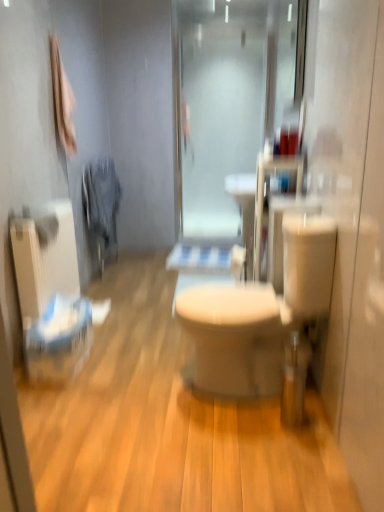
Question: Does beige matte toilet at center have a greater height compared to white glossy toilet at center?

Choices:
 (A) no
 (B) yes

Answer: (B)

Question: Can you confirm if beige matte toilet at center is thinner than white glossy toilet at center?

Choices:
 (A) yes
 (B) no

Answer: (A)

Question: From a real-world perspective, is beige matte toilet at center physically above white glossy toilet at center?

Choices:
 (A) yes
 (B) no

Answer: (A)

Question: Is beige matte toilet at center facing towards white glossy toilet at center?

Choices:
 (A) yes
 (B) no

Answer: (B)

Question: Is beige matte toilet at center next to white glossy toilet at center?

Choices:
 (A) no
 (B) yes

Answer: (A)

Question: Considering the relative positions of beige matte toilet at center and white glossy toilet at center in the image provided, is beige matte toilet at center to the right of white glossy toilet at center from the viewer's perspective?

Choices:
 (A) yes
 (B) no

Answer: (A)

Question: Does white matte toilet paper at center have a lesser width compared to frosted glass shower door at center?

Choices:
 (A) yes
 (B) no

Answer: (B)

Question: Is white matte toilet paper at center further to the viewer compared to frosted glass shower door at center?

Choices:
 (A) no
 (B) yes

Answer: (A)

Question: From the image's perspective, does white matte toilet paper at center appear higher than frosted glass shower door at center?

Choices:
 (A) no
 (B) yes

Answer: (A)

Question: Is white matte toilet paper at center positioned far away from frosted glass shower door at center?

Choices:
 (A) no
 (B) yes

Answer: (B)

Question: Does white matte toilet paper at center lie in front of frosted glass shower door at center?

Choices:
 (A) no
 (B) yes

Answer: (B)

Question: Can frosted glass shower door at center be found inside white matte toilet paper at center?

Choices:
 (A) yes
 (B) no

Answer: (B)

Question: Does frosted glass shower door at center appear on the left side of white glossy toilet at center?

Choices:
 (A) no
 (B) yes

Answer: (A)